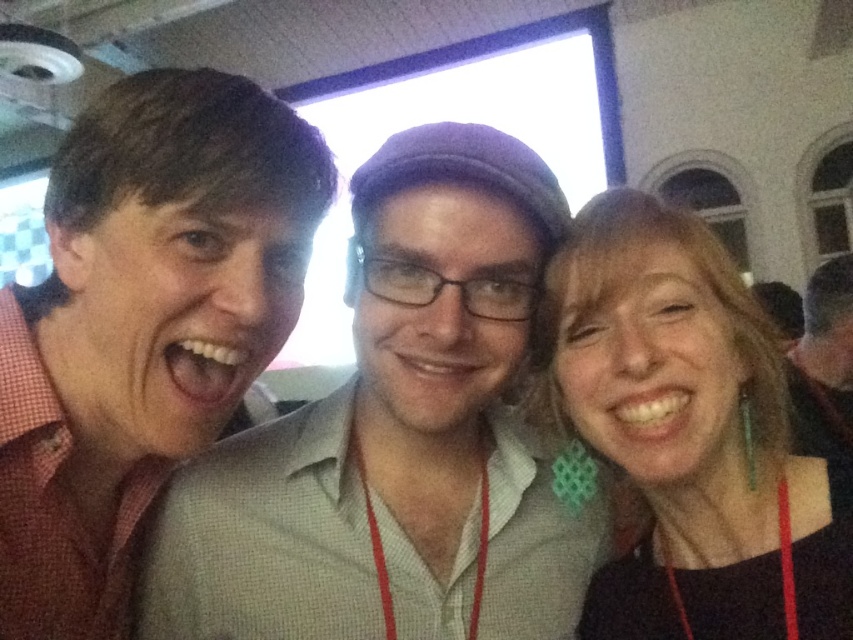
What is the color of the shirt worn by the person at the point coordinates (397,436)?

The point at coordinates (397,436) corresponds to the matte red shirt at center, so the color is red.

You are at a conference and need to identify the person wearing the pink checkered shirt at left. Based on the image description, which direction should you look relative to the matte red shirt at center?

The matte red shirt at center is to the right of the pink checkered shirt at left. Therefore, you should look to the left of the matte red shirt at center to find the pink checkered shirt at left.

You are at a conference and want to discreetly point out the matte red shirt at center to a colleague without mentioning its color. How would you describe its location relative to the black fabric earrings at right?

The matte red shirt at center is positioned under the black fabric earrings at right.